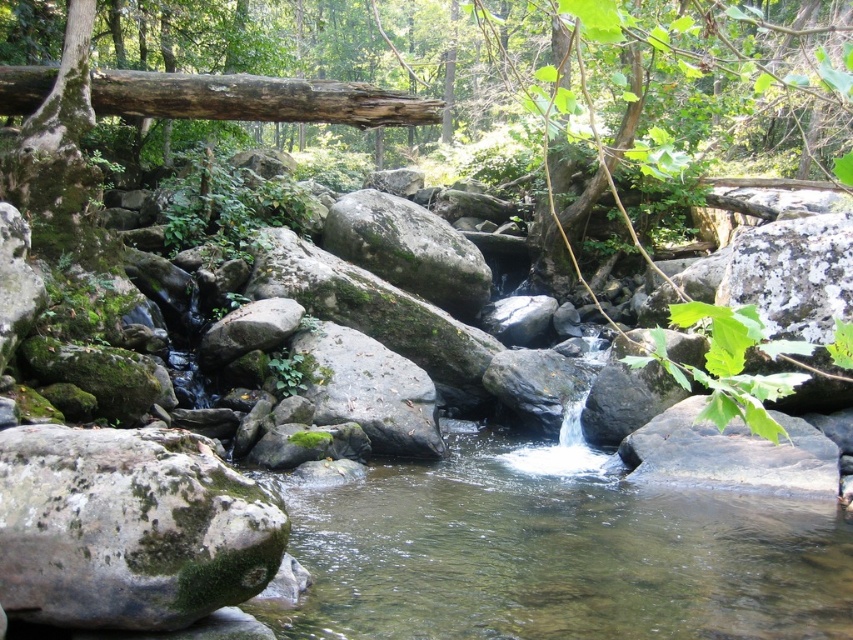
Question: Which point is farther to the camera?

Choices:
 (A) (138, 611)
 (B) (809, 449)

Answer: (B)

Question: Which of the following is the farthest from the observer?

Choices:
 (A) green mossy rock at center
 (B) brown rough log at upper left
 (C) smooth gray rock at lower right
 (D) green mossy rock at lower left

Answer: (A)

Question: Estimate the real-world distances between objects in this image. Which object is closer to the green mossy rock at lower left?

Choices:
 (A) brown rough log at upper left
 (B) smooth gray rock at lower right
 (C) green mossy rock at center

Answer: (B)

Question: Does brown rough log at upper left appear on the left side of green mossy rock at center?

Choices:
 (A) no
 (B) yes

Answer: (B)

Question: Is green mossy rock at lower left below smooth gray rock at lower right?

Choices:
 (A) no
 (B) yes

Answer: (A)

Question: Can you confirm if brown rough log at upper left is thinner than smooth gray rock at lower right?

Choices:
 (A) no
 (B) yes

Answer: (A)